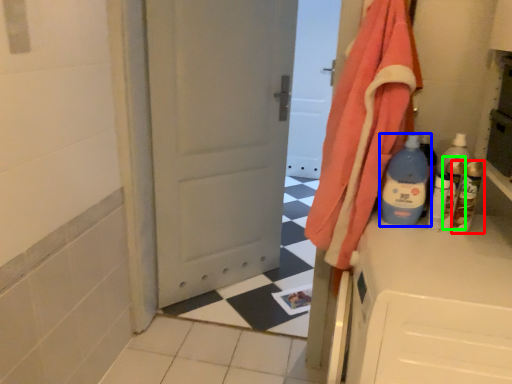
Question: Estimate the real-world distances between objects in this image. Which object is farther from bottle (highlighted by a red box), bottle (highlighted by a blue box) or bottle (highlighted by a green box)?

Choices:
 (A) bottle
 (B) bottle

Answer: (A)